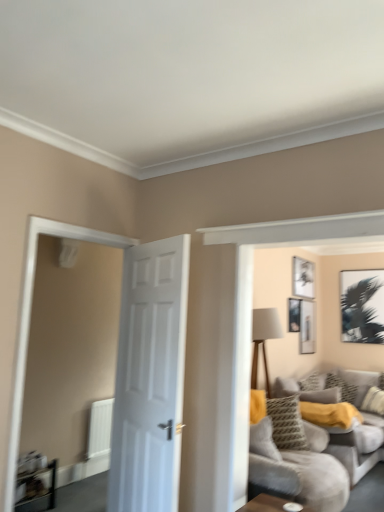
Question: Is black matte picture frame at upper right, arranged as the 1th picture frame when viewed from the right, oriented towards yellow textured pillow at center, the second pillow from the left?

Choices:
 (A) yes
 (B) no

Answer: (B)

Question: Considering the relative sizes of black matte picture frame at upper right, arranged as the 1th picture frame when viewed from the right, and yellow textured pillow at center, the second pillow from the left, in the image provided, is black matte picture frame at upper right, arranged as the 1th picture frame when viewed from the right, shorter than yellow textured pillow at center, the second pillow from the left,?

Choices:
 (A) yes
 (B) no

Answer: (B)

Question: From the image's perspective, is black matte picture frame at upper right, arranged as the 1th picture frame when viewed from the right, above yellow textured pillow at center, which ranks as the second pillow in right-to-left order?

Choices:
 (A) no
 (B) yes

Answer: (B)

Question: Considering the relative sizes of black matte picture frame at upper right, the fourth picture frame in the left-to-right sequence, and yellow textured pillow at center, the second pillow from the left, in the image provided, is black matte picture frame at upper right, the fourth picture frame in the left-to-right sequence, bigger than yellow textured pillow at center, the second pillow from the left,?

Choices:
 (A) yes
 (B) no

Answer: (B)

Question: Is black matte picture frame at upper right, the fourth picture frame in the left-to-right sequence, positioned far away from yellow textured pillow at center, the second pillow from the left?

Choices:
 (A) yes
 (B) no

Answer: (B)

Question: Is point (307, 385) positioned closer to the camera than point (288, 309)?

Choices:
 (A) farther
 (B) closer

Answer: (B)

Question: In the image, is patterned fabric pillow at center-right, arranged as the third pillow when viewed from the right, on the left side or the right side of matte black picture frame at upper center, which is the fourth picture frame from right to left?

Choices:
 (A) left
 (B) right

Answer: (B)

Question: Relative to matte black picture frame at upper center, marked as the first picture frame in a left-to-right arrangement, is patterned fabric pillow at center-right, arranged as the third pillow when viewed from the right, in front or behind?

Choices:
 (A) behind
 (B) front

Answer: (B)

Question: Is patterned fabric pillow at center-right, arranged as the third pillow when viewed from the right, bigger or smaller than matte black picture frame at upper center, marked as the first picture frame in a left-to-right arrangement?

Choices:
 (A) big
 (B) small

Answer: (A)

Question: From a real-world perspective, is wooden table at lower left physically located above or below patterned fabric pillow at right, which is counted as the 1th pillow, starting from the right?

Choices:
 (A) below
 (B) above

Answer: (A)

Question: In terms of height, does wooden table at lower left look taller or shorter compared to patterned fabric pillow at right, which is the third pillow in left-to-right order?

Choices:
 (A) tall
 (B) short

Answer: (B)

Question: Is wooden table at lower left in front of or behind patterned fabric pillow at right, which is the third pillow in left-to-right order, in the image?

Choices:
 (A) behind
 (B) front

Answer: (B)

Question: Visually, is wooden table at lower left positioned to the left or to the right of patterned fabric pillow at right, which is the third pillow in left-to-right order?

Choices:
 (A) left
 (B) right

Answer: (A)

Question: Considering their positions, is clear glass door at left located in front of or behind black matte picture frame at upper right, arranged as the 1th picture frame when viewed from the right?

Choices:
 (A) behind
 (B) front

Answer: (B)

Question: Is point (188, 237) closer or farther from the camera than point (380, 316)?

Choices:
 (A) closer
 (B) farther

Answer: (A)